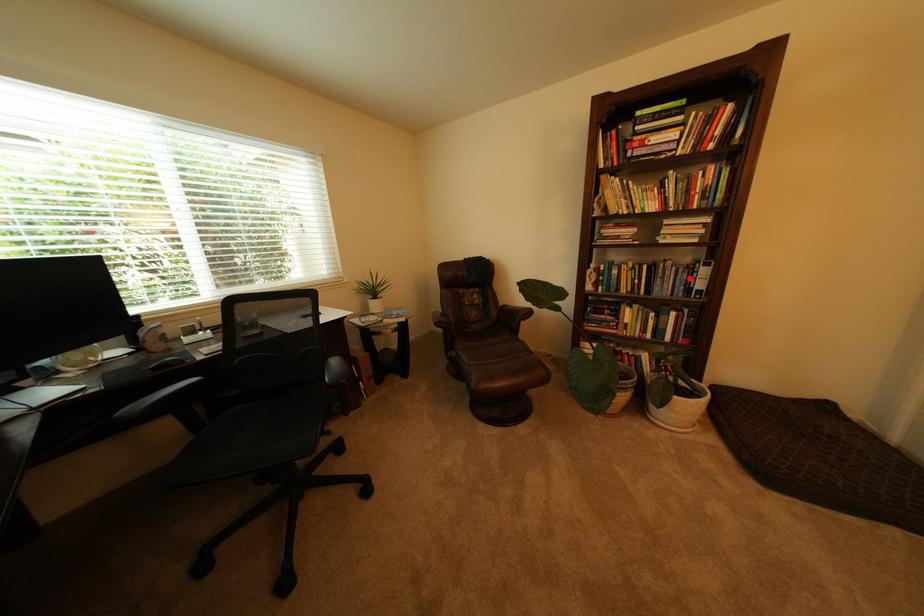
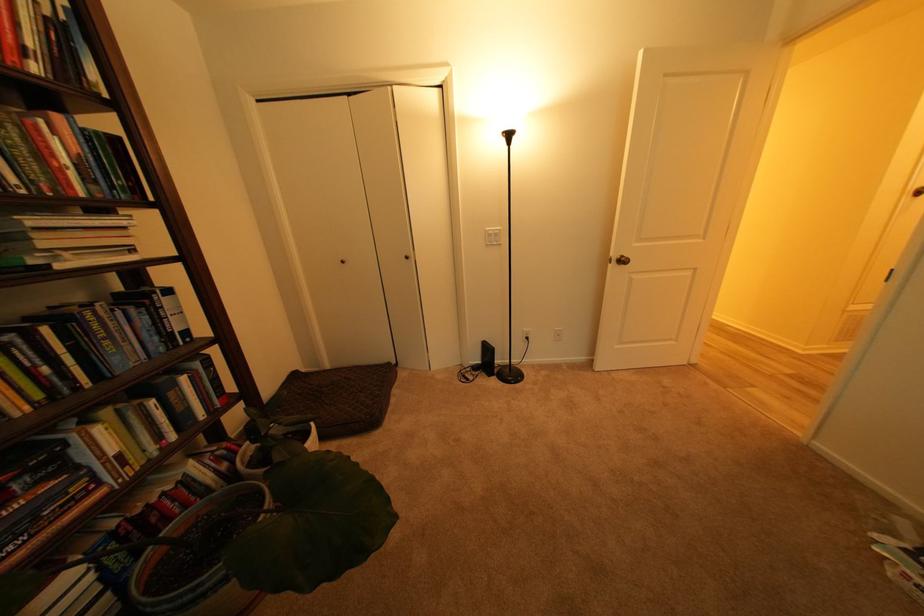
Question: I am providing you with two images of the same scene from different viewpoints. A red point is marked on the first image. At the location where the point appears in image 1, is it still visible in image 2?

Choices:
 (A) Yes
 (B) No

Answer: (A)